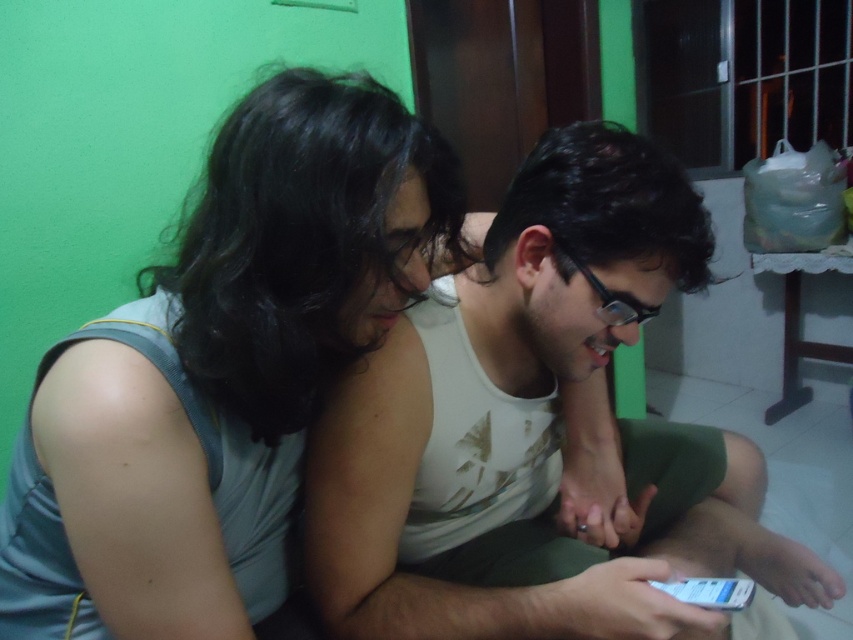
You are a photographer trying to capture a candid shot of both the gray fabric shirt at left and the white matte tank top at center. Since you want to ensure both are fully visible in the frame, which person should you position closer to the camera?

The gray fabric shirt at left is not as tall as the white matte tank top at center, so you should position the gray fabric shirt at left closer to the camera to ensure both are fully visible in the frame.

You are standing in the room and want to reach the point at coordinates (381, 280). If your arm can extend 24 inches, can you reach that point without moving your feet?

The point at coordinates (381, 280) is 24.52 inches away from you. Since your arm can only extend 24 inches, you cannot reach it without moving your feet.

You are a photographer trying to capture a candid shot of the gray fabric shirt at left and the white matte tank top at center. Since you want to ensure both subjects are in focus, which one should you focus on first to maintain depth of field?

The gray fabric shirt at left is positioned over the white matte tank top at center, so focusing on the gray fabric shirt at left first will ensure both are in focus due to its closer proximity to the camera.